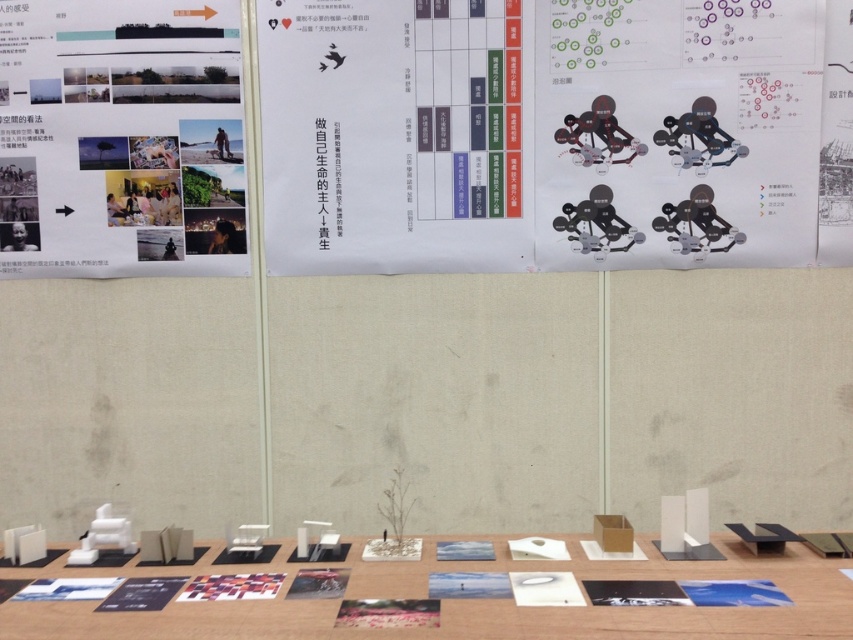
Can you confirm if matte paper collage at upper left is shorter than white matte table at center?

Incorrect, matte paper collage at upper left's height does not fall short of white matte table at center's.

Which is below, matte paper collage at upper left or white matte table at center?

Positioned lower is white matte table at center.

Measure the distance between matte paper collage at upper left and camera.

matte paper collage at upper left and camera are 9.18 feet apart from each other.

Find the location of a particular element. This screenshot has width=853, height=640. matte paper collage at upper left is located at coordinates (120, 138).

Is point (422, 115) positioned in front of point (445, 564)?

That is False.

Does matte black poster at upper center appear on the left side of white matte table at center?

Incorrect, matte black poster at upper center is not on the left side of white matte table at center.

Is point (657, 209) positioned behind point (268, 600)?

Yes, point (657, 209) is farther from viewer.

Find the location of a particular element. This screenshot has height=640, width=853. matte black poster at upper center is located at coordinates (554, 132).

Who is positioned more to the left, matte black poster at upper center or matte paper collage at upper left?

From the viewer's perspective, matte paper collage at upper left appears more on the left side.

What do you see at coordinates (554, 132) in the screenshot? This screenshot has height=640, width=853. I see `matte black poster at upper center` at bounding box center [554, 132].

Who is more distant from viewer, (405,164) or (45,44)?

The point (45,44) is behind.

In order to click on matte black poster at upper center in this screenshot , I will do `click(554, 132)`.